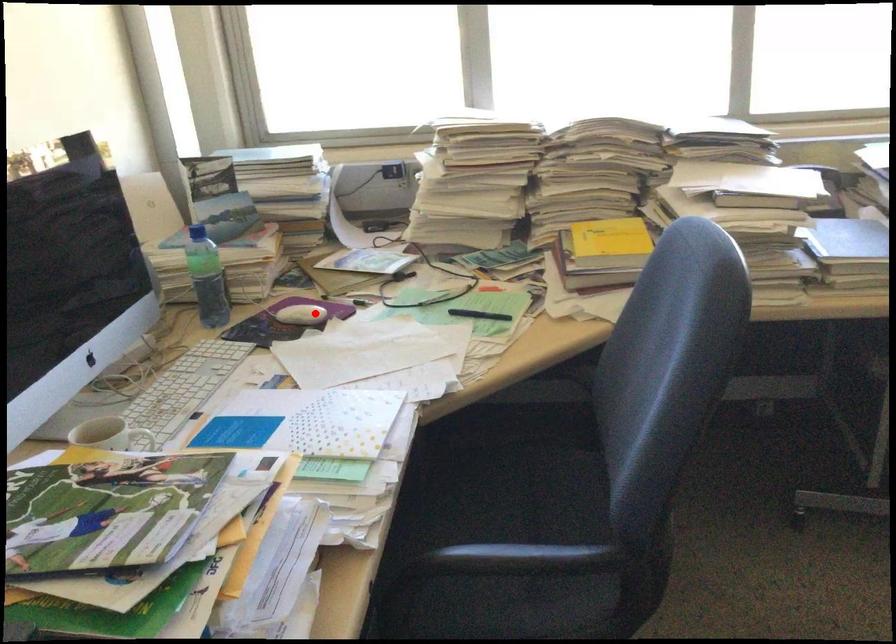
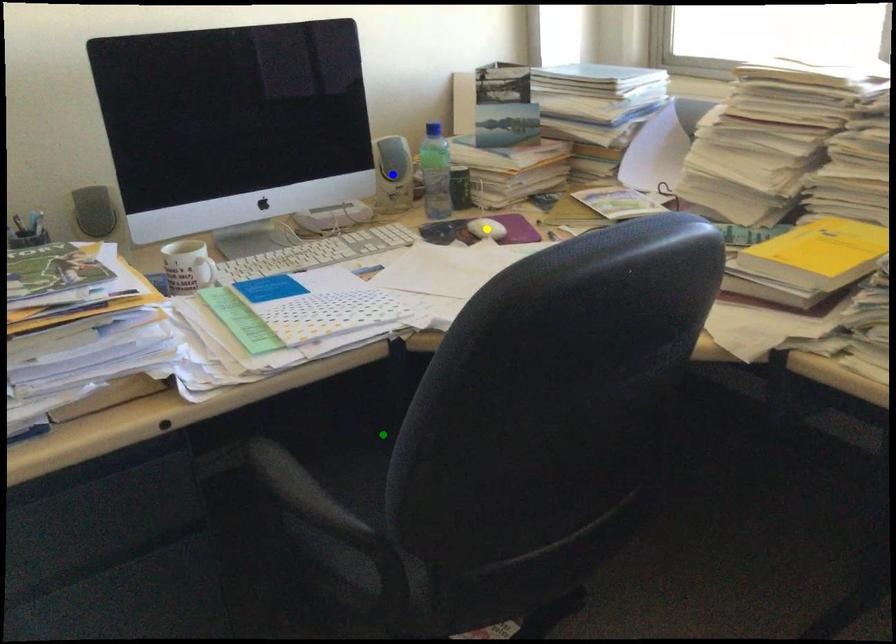
Question: I am providing you with two images of the same scene from different viewpoints. A red point is marked on the first image. You are given multiple points on the second image. In image 2, which mark is for the same physical point as the one in image 1?

Choices:
 (A) yellow point
 (B) blue point
 (C) green point

Answer: (A)